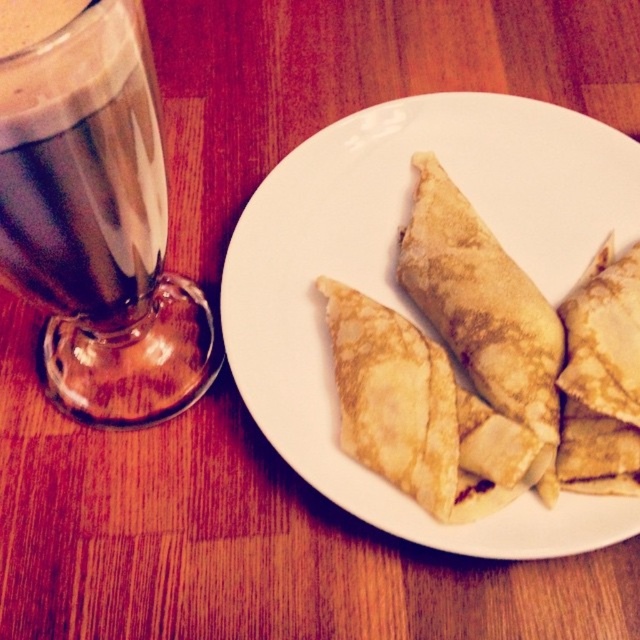
Question: Can you confirm if golden-brown crepes at center is bigger than dark brown liquid at left?

Choices:
 (A) no
 (B) yes

Answer: (B)

Question: Which object is closer to the camera taking this photo?

Choices:
 (A) golden-brown crepes at center
 (B) dark brown liquid at left

Answer: (B)

Question: Can you confirm if golden-brown crepes at center is wider than dark brown liquid at left?

Choices:
 (A) yes
 (B) no

Answer: (A)

Question: Is the position of golden-brown crepes at center less distant than that of dark brown liquid at left?

Choices:
 (A) yes
 (B) no

Answer: (B)

Question: Which point is farther to the camera?

Choices:
 (A) golden-brown crepes at center
 (B) dark brown liquid at left

Answer: (A)